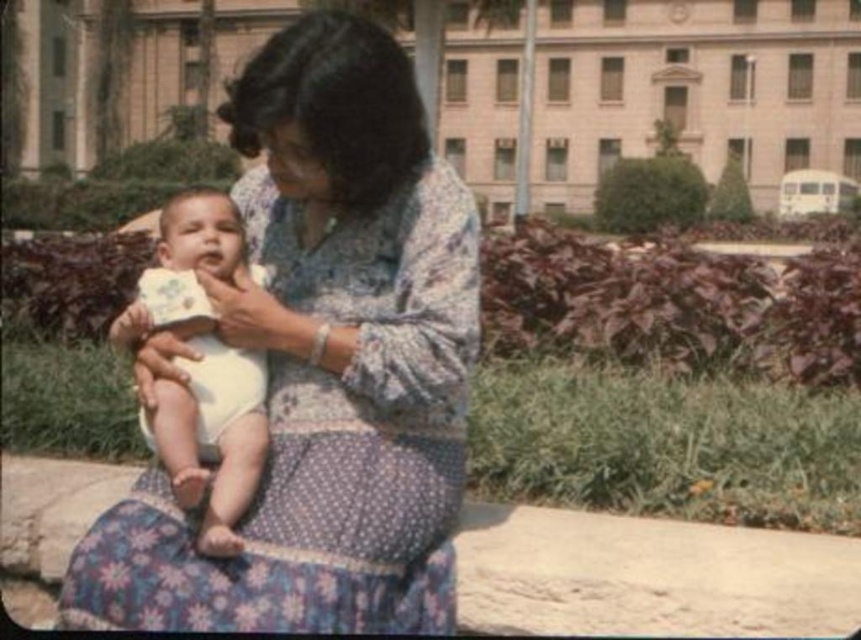
Is floral fabric dress at center further to the viewer compared to white clothed baby at center?

No, it is in front of white clothed baby at center.

Measure the distance between point (413, 257) and camera.

Result: Point (413, 257) is 14.42 meters from camera.

Locate an element on the screen. floral fabric dress at center is located at coordinates (324, 365).